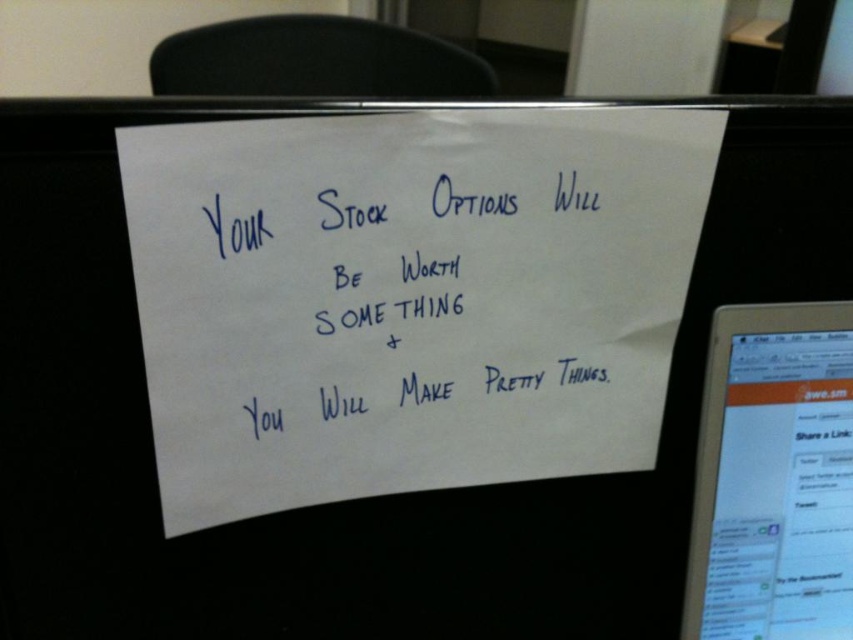
You are standing 1.7 meters tall and looking at the image. The point at coordinate (456, 426) is part of an object in the scene. Based on its distance from the camera, can you estimate whether this point is closer to you or further away compared to the handwritten note?

The point at coordinate (456, 426) is 55.47 centimeters away from the camera. Since the handwritten note is placed on the desk, which is likely closer than the laptop screen or background objects, the point is probably part of the laptop screen or background and therefore further away from the camera than the note.

You are organizing a desk and need to place a small plant between the white paper at center and the white glossy tablet at upper right. Based on their positions, where should the plant be placed?

The white paper at center is closer to the viewer than the white glossy tablet at upper right, so the plant should be placed between them along the line of sight, closer to the white paper at center to maintain balance.

Based on the photo, you are an office worker organizing your desk. You have a white paper at center and blue ink writing at center on your desk. Which object takes up more space on the desk?

The white paper at center is larger in size than the blue ink writing at center, so the white paper at center takes up more space on the desk.